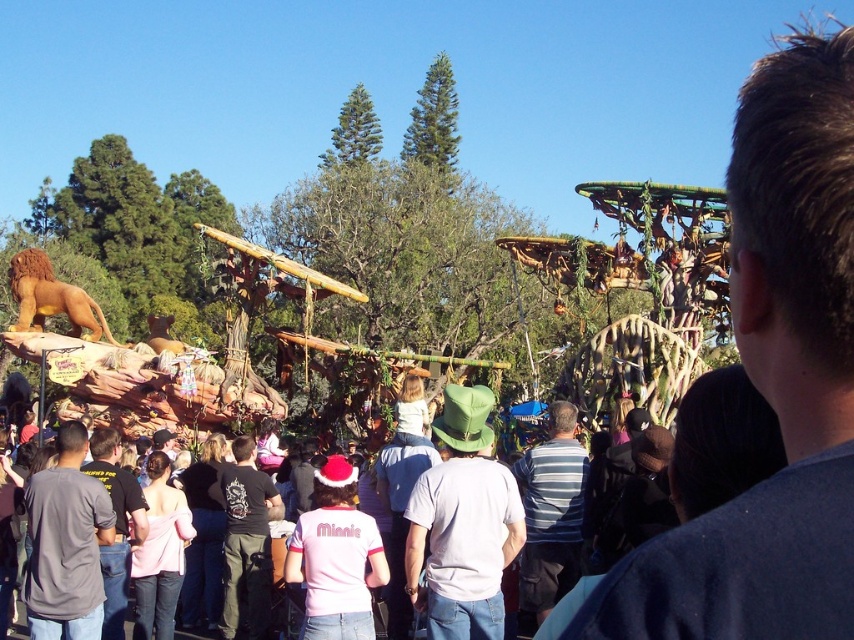
You are a photographer standing at the edge of the crowd, and you want to take a photo that includes both the green felt hat at center and the light pink fabric crowd at center. Can you fit both in the frame if your camera has a maximum field of view of 12 meters?

The green felt hat at center and light pink fabric crowd at center are 12.17 meters apart from each other. Since the camera can only capture up to 12 meters, the distance between them exceeds the maximum field of view. Therefore, both cannot be captured in a single frame.

You are a photographer trying to capture a clear shot of the green felt hat at center and the light pink fabric crowd at center. Based on their heights, which object should you focus on first to ensure it doesn

The green felt hat at center is not as tall as the light pink fabric crowd at center, so you should focus on the light pink fabric crowd at center first to ensure it is in frame before adjusting for the shorter hat.

You are a photographer trying to capture a clear shot of the dark gray shirt at center. However, the dark brown hair at upper right is blocking your view. Based on their sizes, do you think you can adjust your position to avoid the obstruction?

The dark brown hair at upper right has a larger size compared to the dark gray shirt at center. Since the dark brown hair is bigger, it might be more challenging to avoid blocking the dark gray shirt. You might need to move further away to reduce the hair obstruction or shift your angle to ensure the shirt is fully visible.